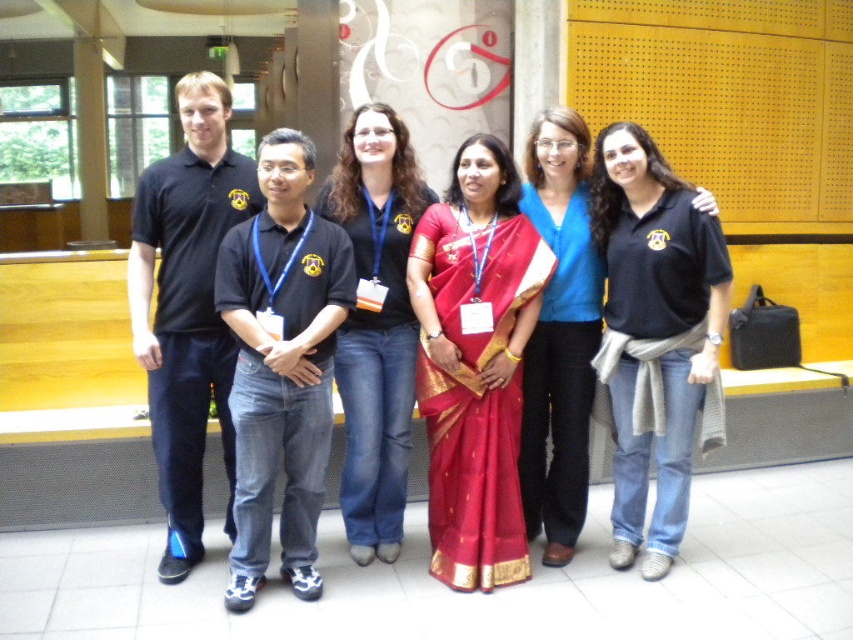
You are a photographer adjusting your camera settings to focus on the silky red sari at center and the black cotton polo shirt at left. Which of these two items is closer to you?

The silky red sari at center is closer to you than the black cotton polo shirt at left.

You are organizing a clothing donation drive and need to categorize the garments based on their size. You have two items to sort today. The first is the silky red sari at center, and the second is the black cotton polo shirt at left. Which of these two items has a smaller size?

The silky red sari at center has a smaller size compared to the black cotton polo shirt at left.